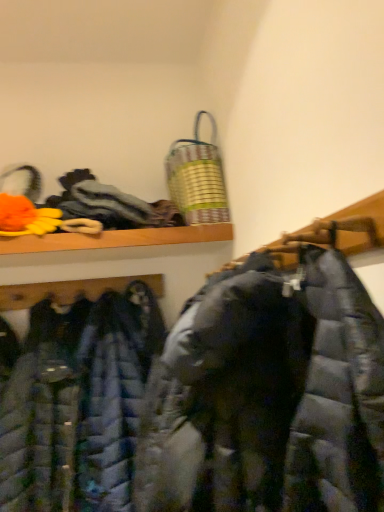
Question: Is metallic striped laundry basket at upper center oriented towards matte black puffer coat at center, the 1th cloak ordered from the bottom?

Choices:
 (A) yes
 (B) no

Answer: (B)

Question: Is metallic striped laundry basket at upper center shorter than matte black puffer coat at center, the 1th cloak ordered from the bottom?

Choices:
 (A) yes
 (B) no

Answer: (A)

Question: From a real-world perspective, is metallic striped laundry basket at upper center under matte black puffer coat at center, the 1th cloak ordered from the bottom?

Choices:
 (A) no
 (B) yes

Answer: (A)

Question: Does metallic striped laundry basket at upper center have a larger size compared to matte black puffer coat at center, which is the 2th cloak from top to bottom?

Choices:
 (A) yes
 (B) no

Answer: (B)

Question: Considering the relative positions of metallic striped laundry basket at upper center and matte black puffer coat at center, which is the 2th cloak from top to bottom, in the image provided, is metallic striped laundry basket at upper center in front of matte black puffer coat at center, which is the 2th cloak from top to bottom,?

Choices:
 (A) yes
 (B) no

Answer: (B)

Question: Would you say matte blue puffer jacket at center, placed as the second jacket when sorted from front to back, is inside or outside metallic striped laundry basket at upper center?

Choices:
 (A) outside
 (B) inside

Answer: (A)

Question: Does point (49, 390) appear closer or farther from the camera than point (192, 183)?

Choices:
 (A) closer
 (B) farther

Answer: (A)

Question: From a real-world perspective, is matte blue puffer jacket at center, the 1th jacket in the back-to-front sequence, physically located above or below metallic striped laundry basket at upper center?

Choices:
 (A) above
 (B) below

Answer: (B)

Question: From the image's perspective, is matte blue puffer jacket at center, placed as the second jacket when sorted from front to back, positioned above or below metallic striped laundry basket at upper center?

Choices:
 (A) below
 (B) above

Answer: (A)

Question: In the image, is metallic striped laundry basket at upper center positioned in front of or behind textured gray cloth at upper left, arranged as the second cloak when ordered from the bottom?

Choices:
 (A) front
 (B) behind

Answer: (B)

Question: Would you say metallic striped laundry basket at upper center is to the left or to the right of textured gray cloth at upper left, arranged as the second cloak when ordered from the bottom, in the picture?

Choices:
 (A) left
 (B) right

Answer: (B)

Question: From the image's perspective, relative to textured gray cloth at upper left, arranged as the second cloak when ordered from the bottom, is metallic striped laundry basket at upper center above or below?

Choices:
 (A) below
 (B) above

Answer: (B)

Question: Is metallic striped laundry basket at upper center inside or outside of textured gray cloth at upper left, arranged as the second cloak when ordered from the bottom?

Choices:
 (A) outside
 (B) inside

Answer: (A)

Question: In terms of height, does matte black puffer jacket at center, which appears as the first jacket when viewed from the front, look taller or shorter compared to matte black puffer coat at center, which is the 2th cloak from top to bottom?

Choices:
 (A) tall
 (B) short

Answer: (B)

Question: Visually, is matte black puffer jacket at center, which appears as the first jacket when viewed from the front, positioned to the left or to the right of matte black puffer coat at center, the 1th cloak ordered from the bottom?

Choices:
 (A) right
 (B) left

Answer: (A)